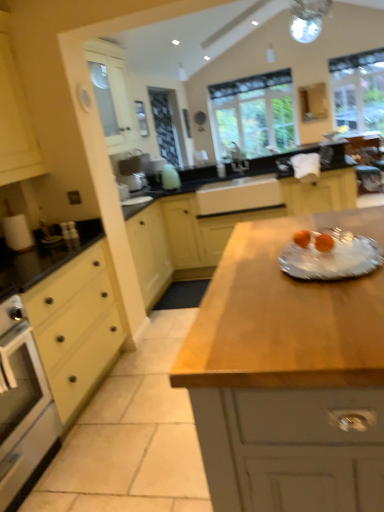
I want to click on free space underneath clear glass plate at center (from a real-world perspective), so (319, 255).